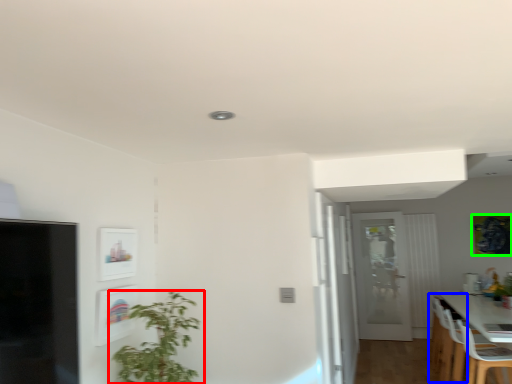
Question: Which is nearer to the houseplant (highlighted by a red box)? chair (highlighted by a blue box) or picture frame (highlighted by a green box).

Choices:
 (A) chair
 (B) picture frame

Answer: (A)